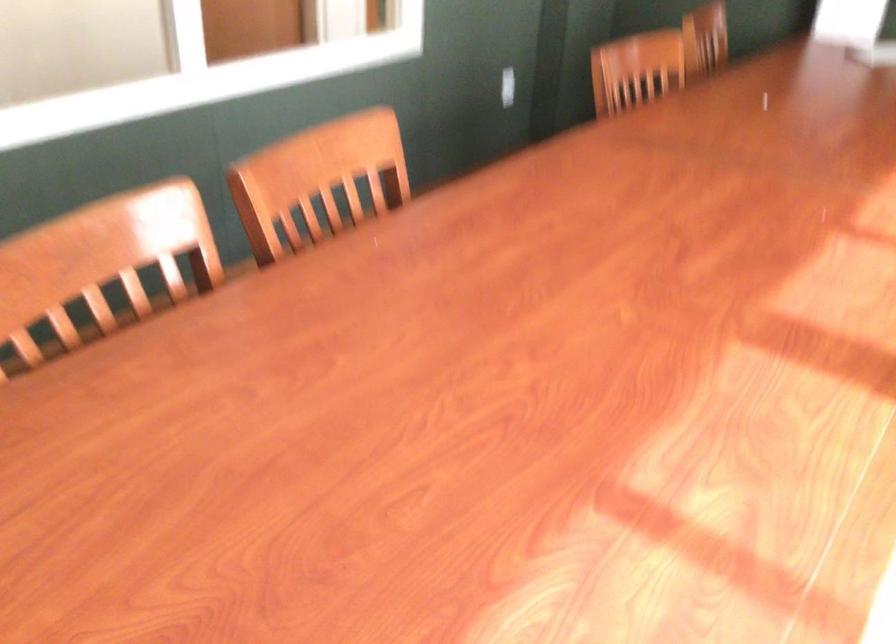
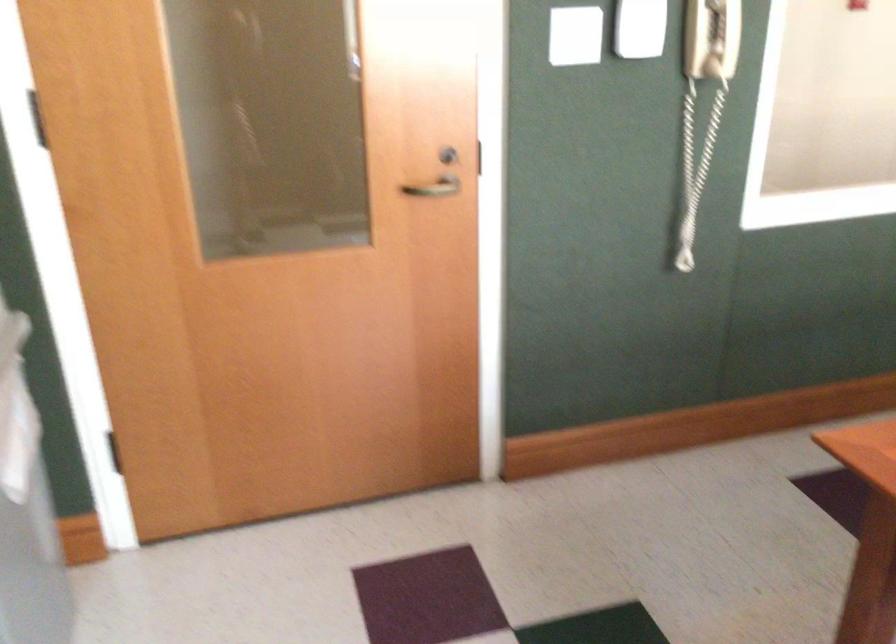
Question: How did the camera likely rotate?

Choices:
 (A) Left
 (B) Right
 (C) Up
 (D) Down

Answer: (A)